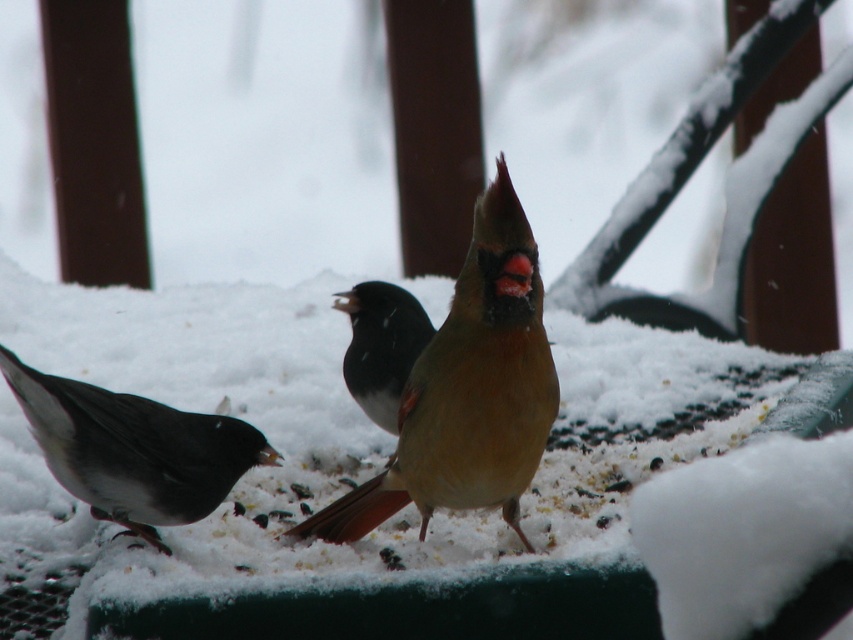
You are standing 2 meters away from a dark gray matte sparrow at lower left. Can you safely reach out and touch it without moving your feet?

The dark gray matte sparrow at lower left and camera are 1.80 meters apart from each other. Since you are standing 2 meters away, you are slightly farther than the 1.80 meters required, so you cannot safely reach it without moving your feet.